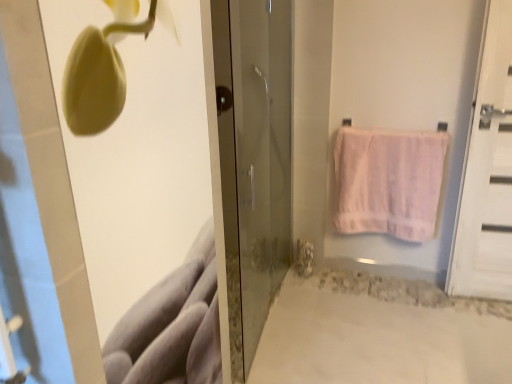
Question: Considering the positions of white wooden door at right, marked as the 1th door in a right-to-left arrangement, and transparent glass door at center, which is the second door in right-to-left order, in the image, is white wooden door at right, marked as the 1th door in a right-to-left arrangement, bigger or smaller than transparent glass door at center, which is the second door in right-to-left order,?

Choices:
 (A) small
 (B) big

Answer: (A)

Question: Looking at their shapes, would you say white wooden door at right, marked as the 1th door in a right-to-left arrangement, is wider or thinner than transparent glass door at center, arranged as the first door when viewed from the left?

Choices:
 (A) thin
 (B) wide

Answer: (A)

Question: Which object is positioned closest to the pink cotton towel at right?

Choices:
 (A) white wooden door at right, which ranks as the second door in left-to-right order
 (B) transparent glass door at center, arranged as the first door when viewed from the left

Answer: (A)

Question: Based on their relative distances, which object is farther from the pink cotton towel at right?

Choices:
 (A) white wooden door at right, marked as the 1th door in a right-to-left arrangement
 (B) transparent glass door at center, arranged as the first door when viewed from the left

Answer: (B)